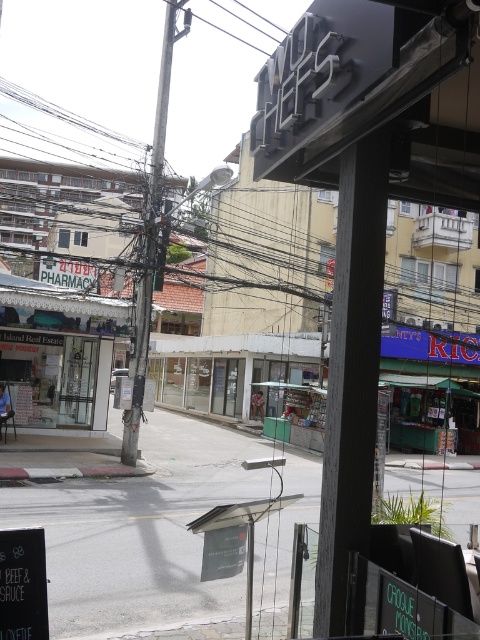
Does black matte pole at center appear on the left side of metallic gray pole at center?

Incorrect, black matte pole at center is not on the left side of metallic gray pole at center.

Is black matte pole at center closer to the viewer compared to metallic gray pole at center?

Yes, black matte pole at center is in front of metallic gray pole at center.

Which is in front, point (339, 428) or point (151, 268)?

Positioned in front is point (339, 428).

This screenshot has width=480, height=640. I want to click on black matte pole at center, so [351, 387].

The height and width of the screenshot is (640, 480). What do you see at coordinates (58, 352) in the screenshot? I see `white glass storefront at left` at bounding box center [58, 352].

Is white glass storefront at left positioned behind metallic gray pole at center?

Yes.

Does point (47, 285) lie behind point (164, 125)?

Yes, point (47, 285) is farther from viewer.

You are a GUI agent. You are given a task and a screenshot of the screen. Output one action in this format:
    pyautogui.click(x=<x>, y=<y>)
    Task: Click on the white glass storefront at left
    
    Given the screenshot: What is the action you would take?
    pyautogui.click(x=58, y=352)

The width and height of the screenshot is (480, 640). What are the coordinates of `black matte pole at center` in the screenshot? It's located at (351, 387).

Which is below, black matte pole at center or white glass storefront at left?

white glass storefront at left is below.

Between point (372, 248) and point (20, 364), which one is positioned behind?

The point (20, 364) is behind.

I want to click on black matte pole at center, so click(351, 387).